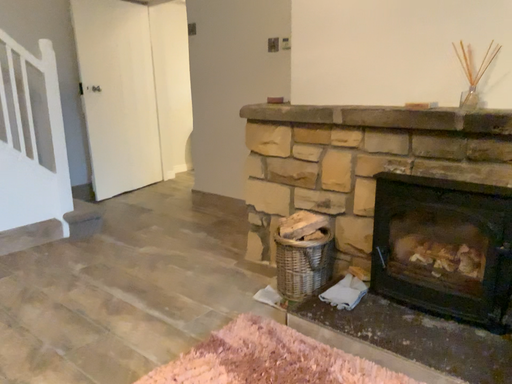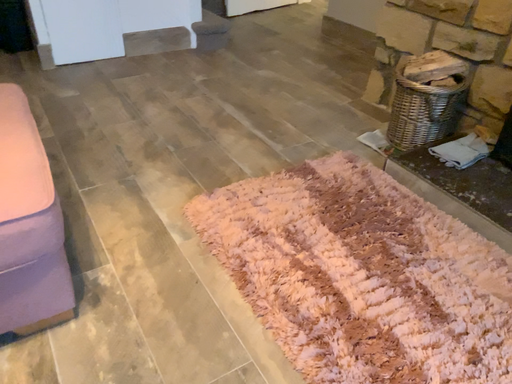
Question: Which way did the camera rotate in the video?

Choices:
 (A) rotated upward
 (B) rotated downward

Answer: (B)